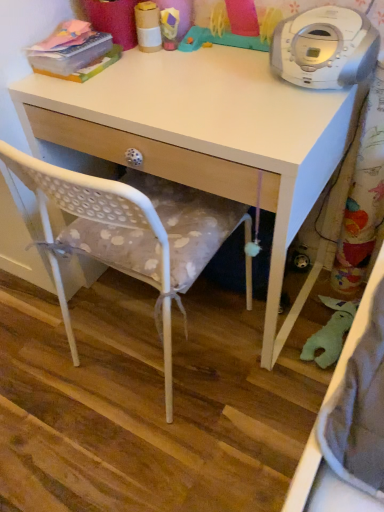
Question: Considering the positions of white plastic cd player at upper right and cardboard tube at upper center, which is the 2th toy in right-to-left order, in the image, is white plastic cd player at upper right bigger or smaller than cardboard tube at upper center, which is the 2th toy in right-to-left order,?

Choices:
 (A) small
 (B) big

Answer: (B)

Question: Is white plastic cd player at upper right in front of or behind cardboard tube at upper center, which is the 2th toy in right-to-left order, in the image?

Choices:
 (A) behind
 (B) front

Answer: (B)

Question: Which object is positioned closest to the white polka dot fabric chair at center?

Choices:
 (A) white plastic cd player at upper right
 (B) white matte desk at center
 (C) rubber duck at upper center, which is the first toy from right to left
 (D) cardboard tube at upper center, which is the 2th toy in right-to-left order

Answer: (B)

Question: Which of these objects is positioned closest to the cardboard tube at upper center, which is the 1th toy from left to right?

Choices:
 (A) white matte desk at center
 (B) white plastic cd player at upper right
 (C) white polka dot fabric chair at center
 (D) rubber duck at upper center, which ranks as the 2th toy in left-to-right order

Answer: (D)